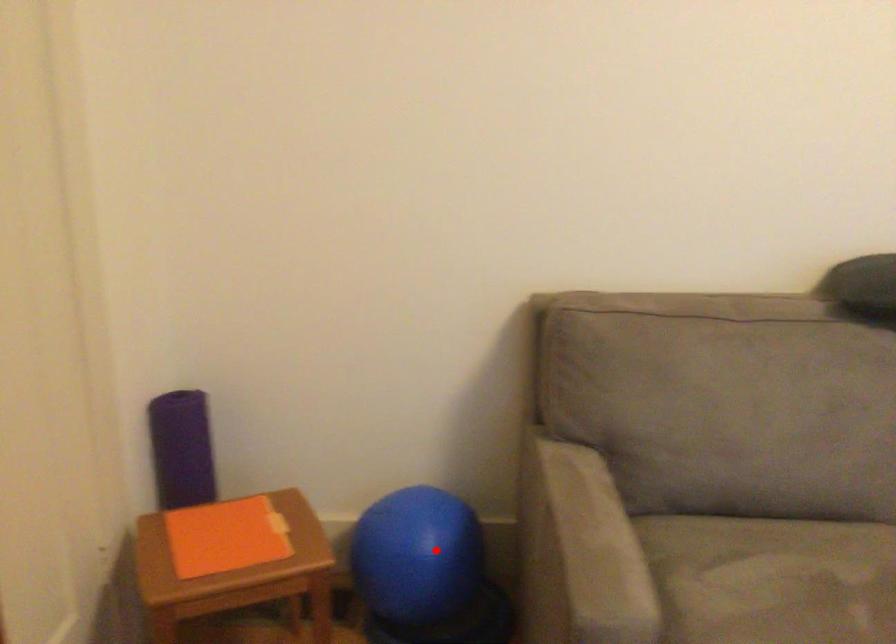
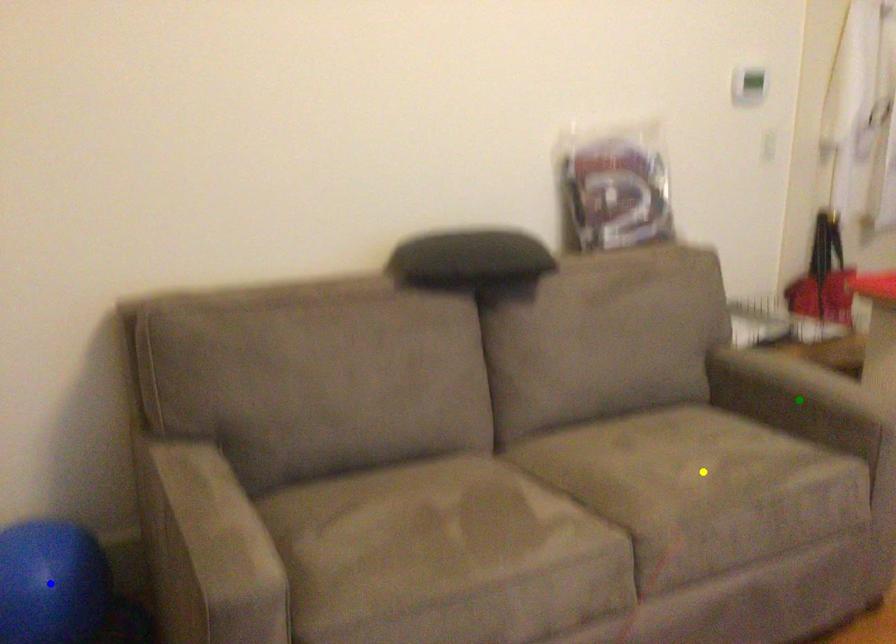
Question: I am providing you with two images of the same scene from different viewpoints. A red point is marked on the first image. You are given multiple points on the second image. Which spot in image 2 lines up with the point in image 1?

Choices:
 (A) green point
 (B) blue point
 (C) yellow point

Answer: (B)